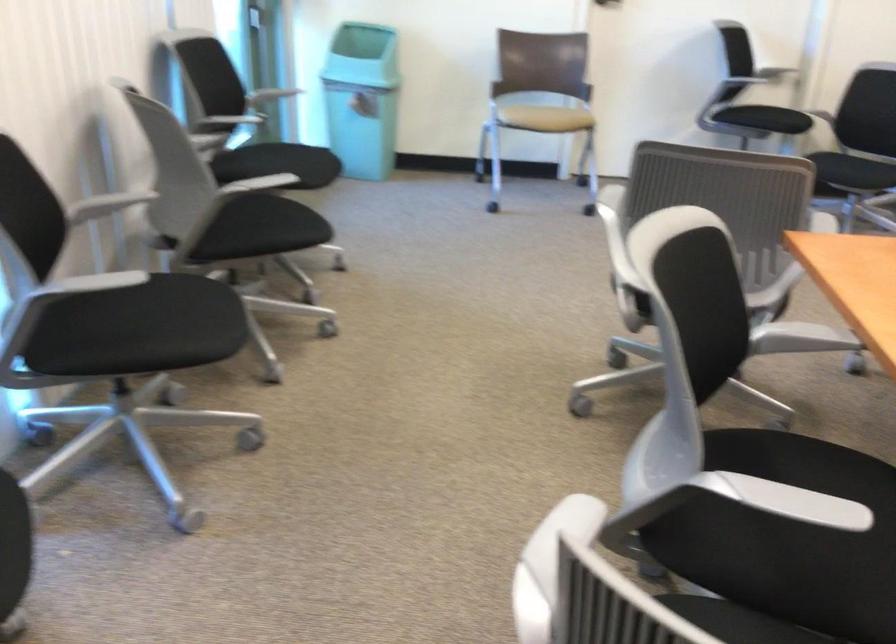
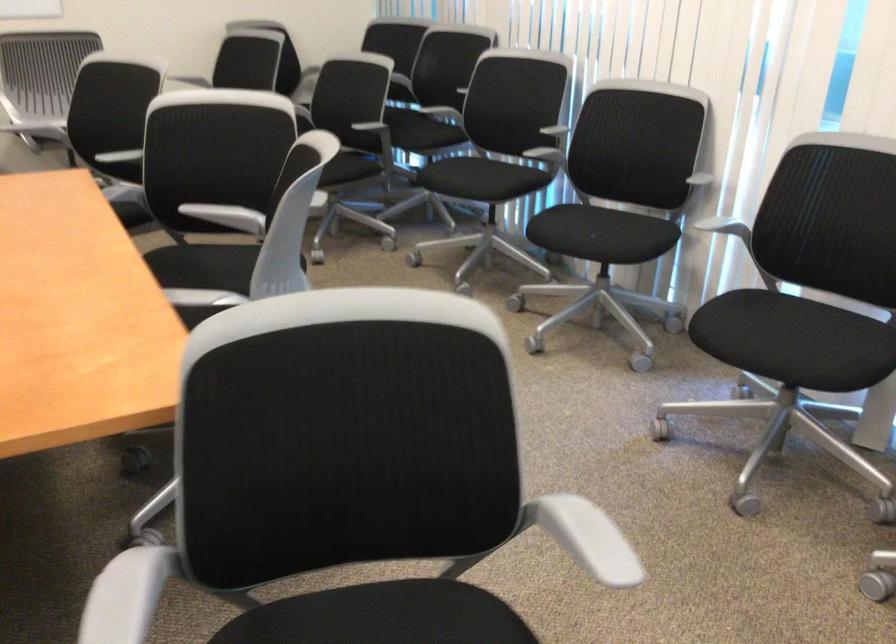
The point at (73,277) is marked in the first image. Where is the corresponding point in the second image?

(725, 228)